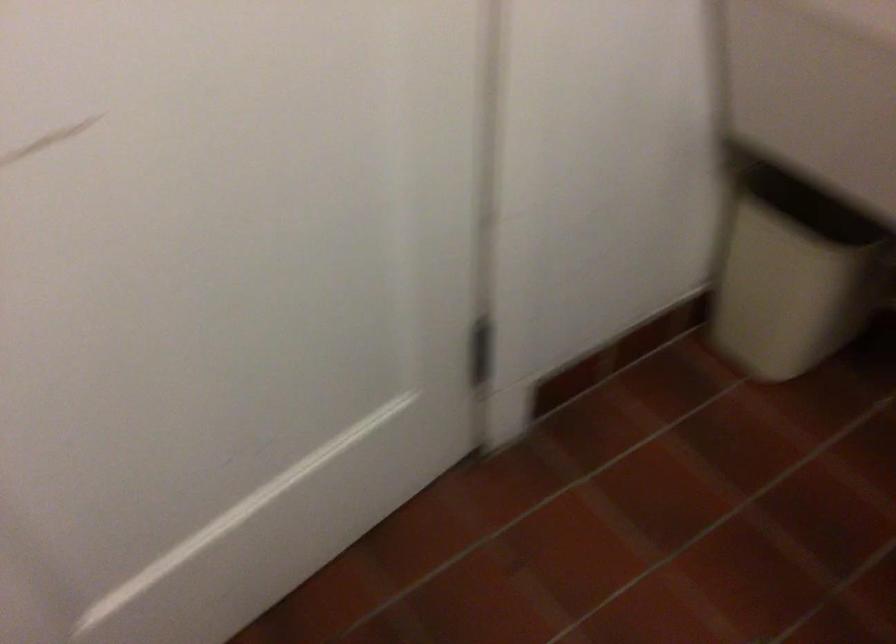
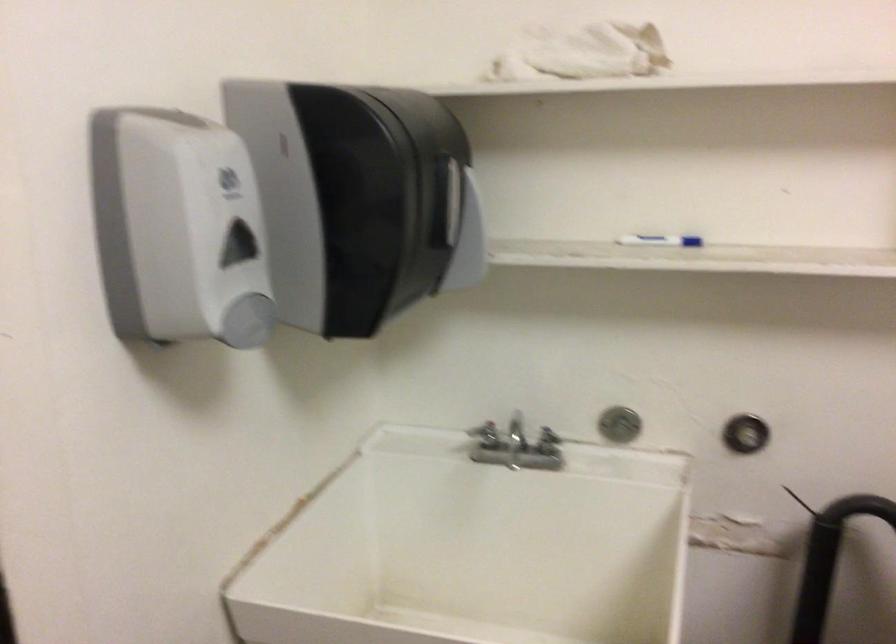
How did the camera likely rotate?

The camera rotated toward right-up.